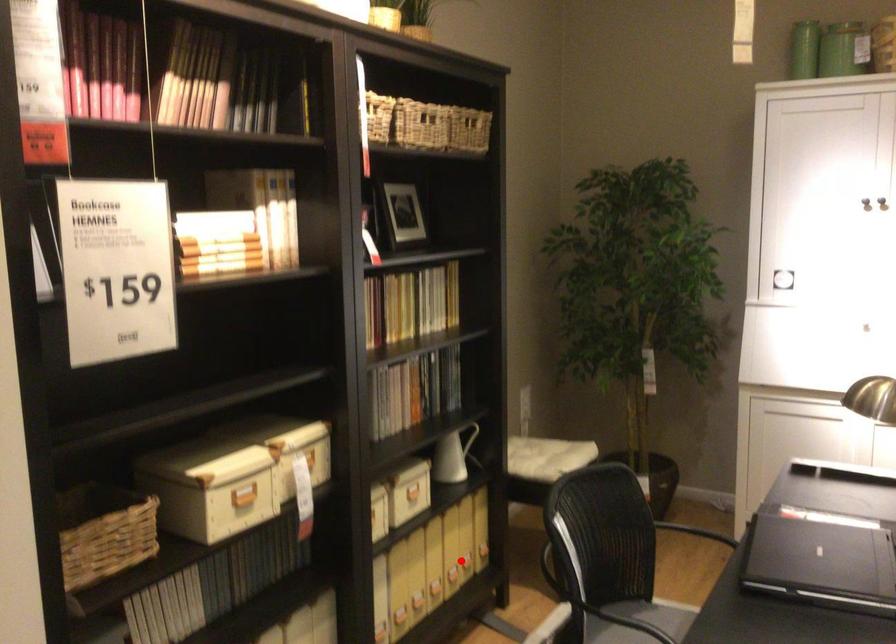
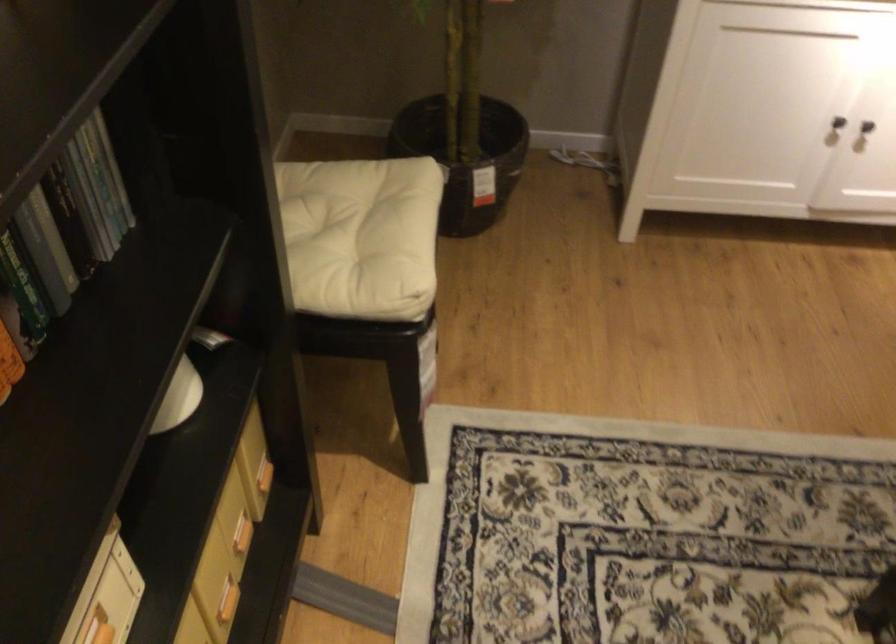
Question: I am providing you with two images of the same scene from different viewpoints. Image1 has a red point marked. In image2, the corresponding 3D location appears at what relative position? Reply with the corresponding letter.

Choices:
 (A) Closer
 (B) Farther

Answer: (A)